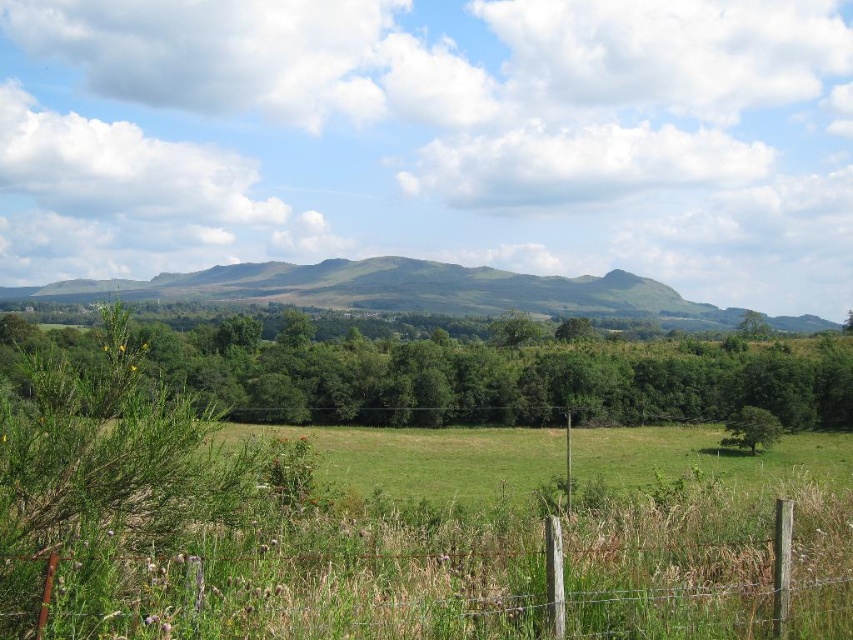
Where is `green leafy tree at center`? green leafy tree at center is located at coordinates (498, 378).

Locate an element on the screen. This screenshot has width=853, height=640. green leafy tree at center is located at coordinates (498, 378).

Which is more to the left, green grassy hill at center or green leafy tree at lower right?

Positioned to the left is green grassy hill at center.

Can you confirm if green grassy hill at center is positioned below green leafy tree at lower right?

Actually, green grassy hill at center is above green leafy tree at lower right.

Is point (440, 280) positioned behind point (764, 422)?

Yes, point (440, 280) is behind point (764, 422).

Where is `green grassy hill at center`? This screenshot has width=853, height=640. green grassy hill at center is located at coordinates (399, 291).

Does brown wooden fence at lower center have a larger size compared to green leafy tree at lower right?

Incorrect, brown wooden fence at lower center is not larger than green leafy tree at lower right.

Is brown wooden fence at lower center thinner than green leafy tree at lower right?

Yes.

You are a GUI agent. You are given a task and a screenshot of the screen. Output one action in this format:
    pyautogui.click(x=<x>, y=<y>)
    Task: Click on the brown wooden fence at lower center
    The height and width of the screenshot is (640, 853).
    Given the screenshot: What is the action you would take?
    pyautogui.click(x=479, y=582)